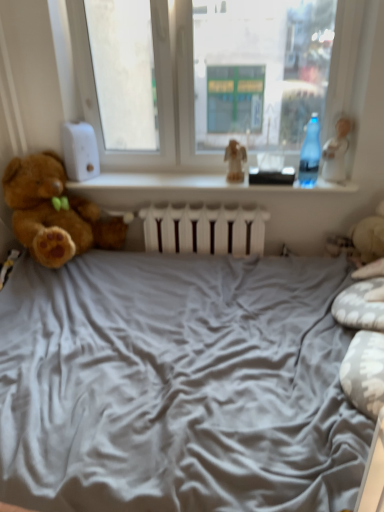
Question: Is white glossy figurine at upper right, the second toy when ordered from left to right, spatially inside transparent glass window at center, or outside of it?

Choices:
 (A) inside
 (B) outside

Answer: (A)

Question: From a real-world perspective, is white glossy figurine at upper right, the second toy when ordered from left to right, above or below transparent glass window at center?

Choices:
 (A) above
 (B) below

Answer: (B)

Question: Which of these objects is positioned farthest from the white glossy figurine at upper right, the second toy when ordered from left to right?

Choices:
 (A) brown plush teddy bear at left
 (B) transparent plastic bottle at right
 (C) transparent plastic bottle at upper center
 (D) transparent glass window at center
 (E) matte brown figurine at center, the 2th toy in the right-to-left sequence

Answer: (A)

Question: Which object is the farthest from the white glossy figurine at upper right, which is the 1th toy in right-to-left order?

Choices:
 (A) transparent glass window at center
 (B) matte brown figurine at center, the 1th toy from the left
 (C) transparent plastic bottle at upper center
 (D) transparent plastic bottle at right
 (E) brown plush teddy bear at left

Answer: (E)